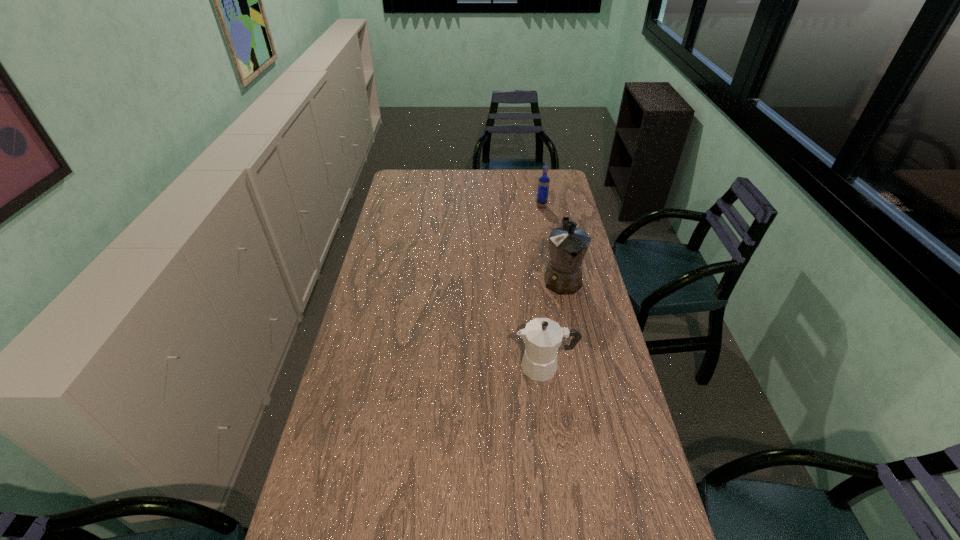
Where is `vodka that is at the right edge`? vodka that is at the right edge is located at coordinates [543, 186].

In the image, there is a desktop. Identify the location of blank space at the far edge. This screenshot has width=960, height=540. (494, 183).

In the image, there is a desktop. In order to click on vacant space at the left edge in this screenshot , I will do `click(391, 325)`.

At what (x,y) coordinates should I click in order to perform the action: click on vacant area at the right edge of the desktop. Please return your answer as a coordinate pair (x, y). Looking at the image, I should click on (572, 204).

Locate an element on the screen. vacant space at the far left corner of the desktop is located at coordinates (413, 178).

Identify the location of free point between the farthest object and the nearest object. (543, 287).

The height and width of the screenshot is (540, 960). Identify the location of free spot between the nearest object and the farthest object. (543, 287).

The width and height of the screenshot is (960, 540). In order to click on free space that is in between the nearest object and the vodka in this screenshot , I will do pos(543,287).

Image resolution: width=960 pixels, height=540 pixels. In order to click on the closest object to the second farthest object in this screenshot , I will do `click(542, 336)`.

Point out which object is positioned as the nearest to the farther coffeepot. Please provide its 2D coordinates. Your answer should be formatted as a tuple, i.e. [(x, y)], where the tuple contains the x and y coordinates of a point satisfying the conditions above.

[(542, 336)]